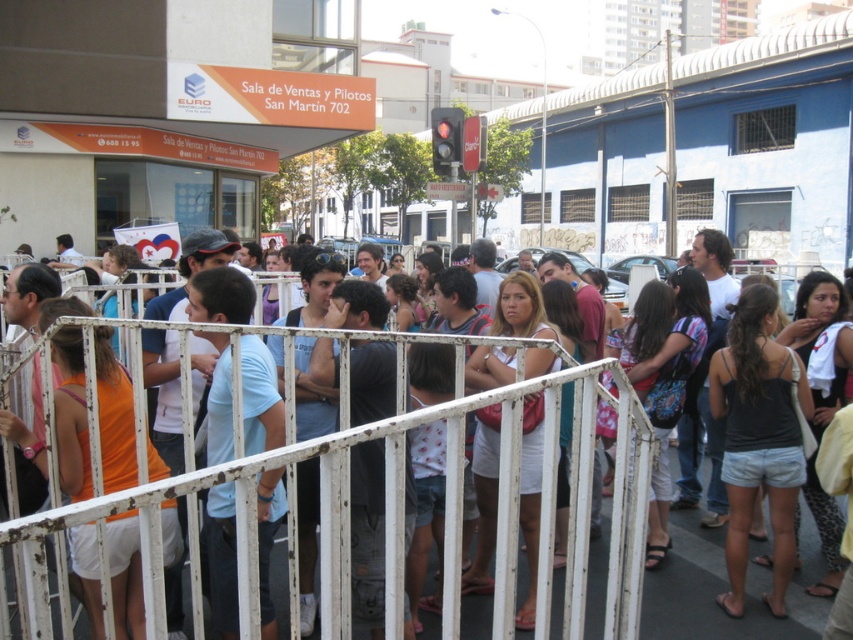
You are a person standing at the back of the crowd behind the white metal rail at center. You want to move forward to the front of the crowd. How many steps do you need to take to reach the front?

The distance between you and the front is 4.63 feet. Assuming an average step length of about 2.5 feet, you would need approximately 2 steps to reach the front.

In the scene outside the building labeled Sala de Ventas y Pilotos San Martin 702, there is a point at coordinates (758, 438). Which object from the list below is located at that point? Select from the objects listed below. Objects are black denim shorts at center, white metal fence at lower left, and blue painted building at upper right.

The point at coordinates (758, 438) is on the black denim shorts at center.